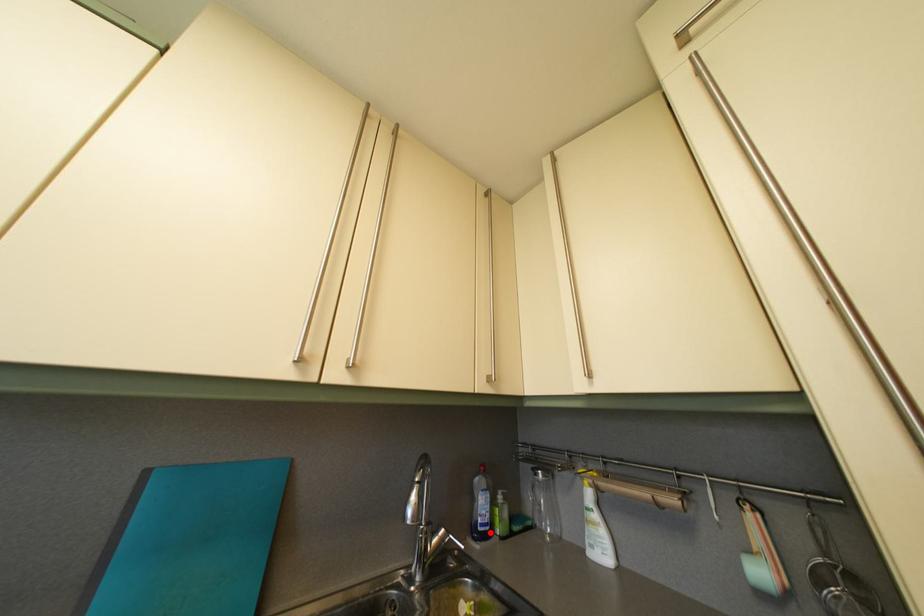
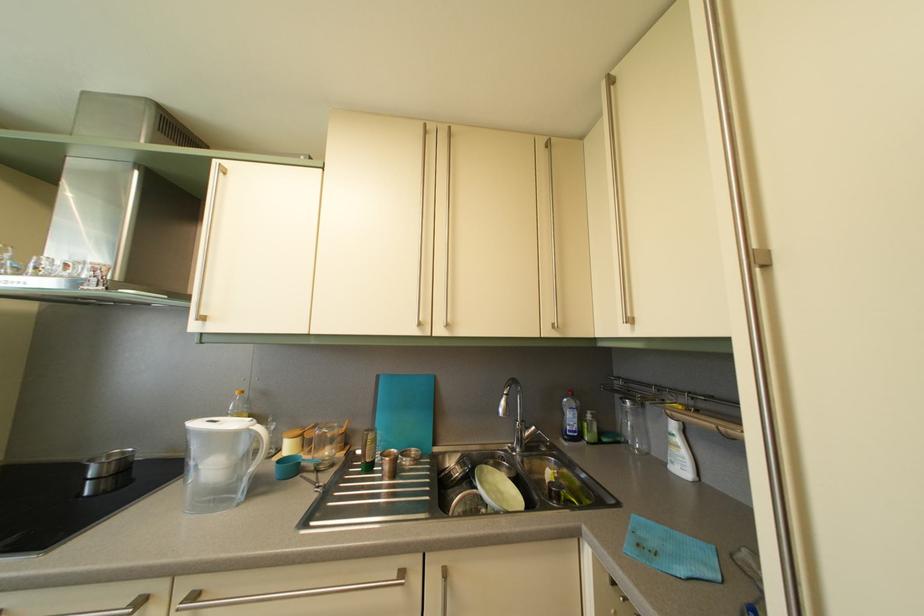
Question: I am providing you with two images of the same scene from different viewpoints. A red point is marked on the first image. Can you still see the location of the red point in image 2?

Choices:
 (A) Yes
 (B) No

Answer: (A)